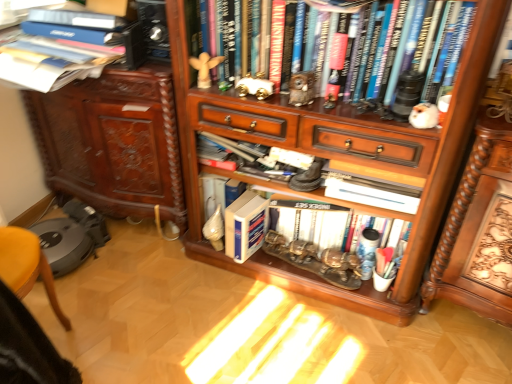
Find the location of a particular element. Image resolution: width=512 pixels, height=384 pixels. vacant region to the left of wooden bookcase at center is located at coordinates (159, 302).